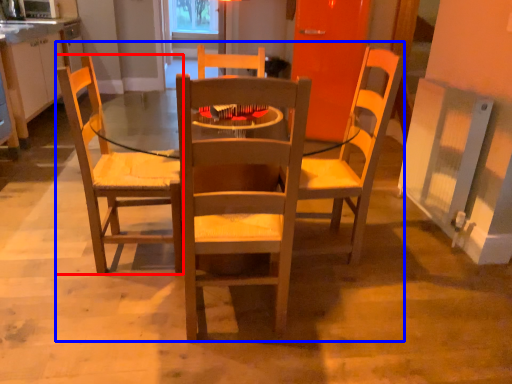
Question: Which of the following is the farthest to the observer, chair (highlighted by a red box) or trio (highlighted by a blue box)?

Choices:
 (A) chair
 (B) trio

Answer: (A)